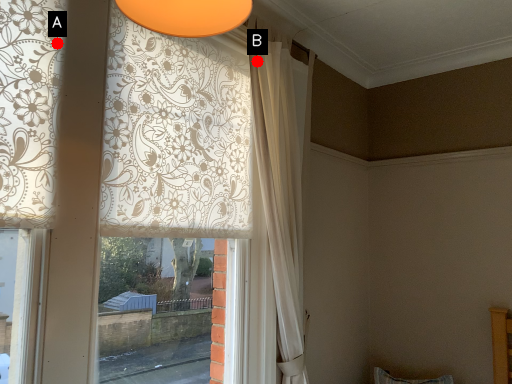
Question: Two points are circled on the image, labeled by A and B beside each circle. Which point is farther from the camera taking this photo?

Choices:
 (A) A is further
 (B) B is further

Answer: (B)